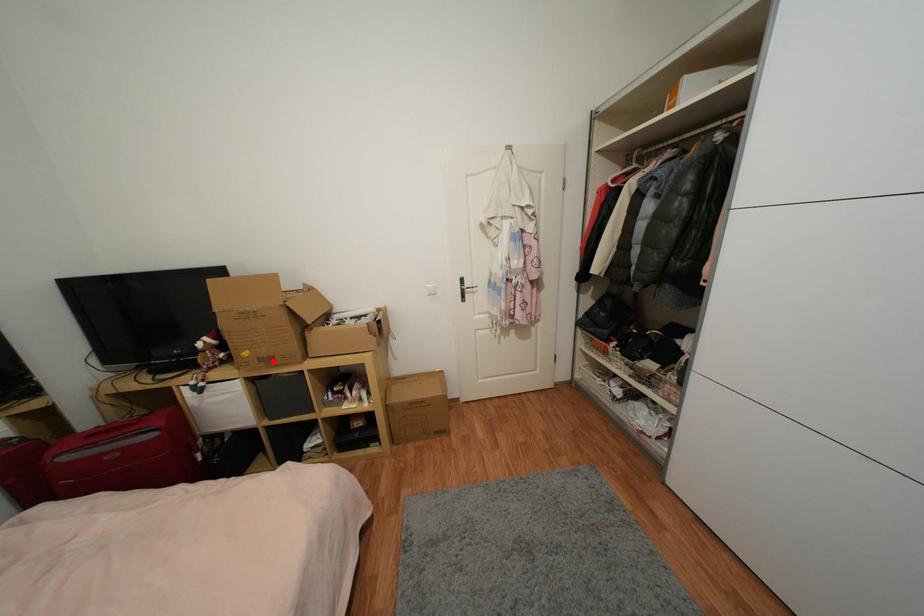
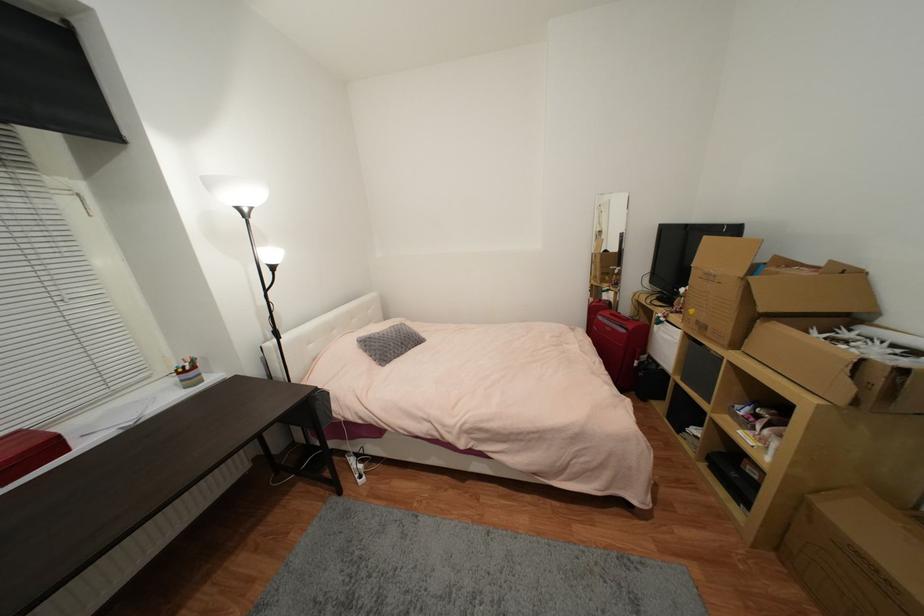
Find the pixel in the second image that matches the highlighted location in the first image.

(708, 329)